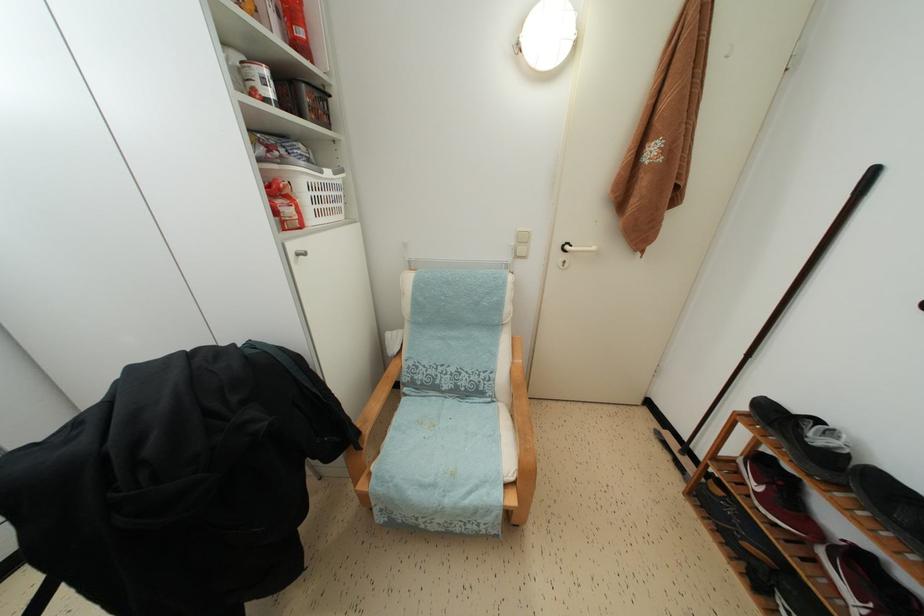
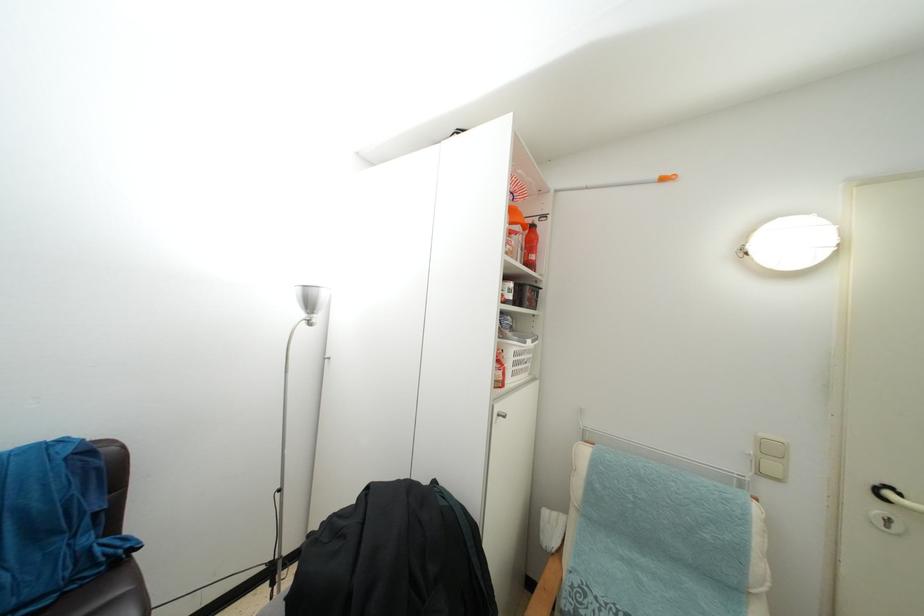
The images are taken continuously from a first-person perspective. In which direction is your viewpoint rotating?

The camera rotated toward left-up.